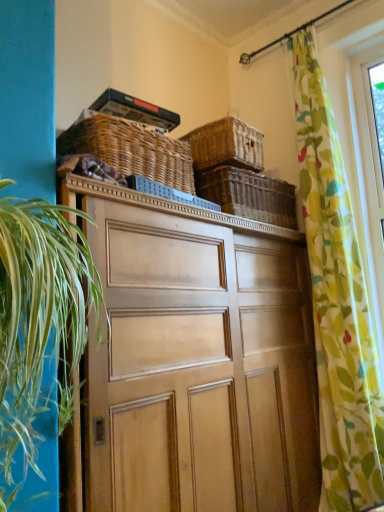
Question: From the image's perspective, would you say woven brown basket at upper center, marked as the third basket in a right-to-left arrangement, is shown under woven brown basket at upper center, which is the 2th basket in right-to-left order?

Choices:
 (A) no
 (B) yes

Answer: (B)

Question: Does woven brown basket at upper center, marked as the third basket in a right-to-left arrangement, have a greater width compared to woven brown basket at upper center, which is the 2th basket in right-to-left order?

Choices:
 (A) yes
 (B) no

Answer: (B)

Question: Is woven brown basket at upper center, which is the 2th basket in right-to-left order, at the back of woven brown basket at upper center, marked as the third basket in a right-to-left arrangement?

Choices:
 (A) no
 (B) yes

Answer: (A)

Question: Is woven brown basket at upper center, positioned as the first basket in left-to-right order, shorter than woven brown basket at upper center, which is counted as the 2th basket, starting from the left?

Choices:
 (A) yes
 (B) no

Answer: (B)

Question: Is woven brown basket at upper center, positioned as the first basket in left-to-right order, at the right side of woven brown basket at upper center, which is the 2th basket in right-to-left order?

Choices:
 (A) no
 (B) yes

Answer: (A)

Question: Considering the relative sizes of woven brown basket at upper center, positioned as the first basket in left-to-right order, and woven brown basket at upper center, which is counted as the 2th basket, starting from the left, in the image provided, is woven brown basket at upper center, positioned as the first basket in left-to-right order, taller than woven brown basket at upper center, which is counted as the 2th basket, starting from the left,?

Choices:
 (A) no
 (B) yes

Answer: (B)

Question: Considering the relative sizes of woven wicker basket at upper center, the 1th basket when ordered from right to left, and green leafy plant at left in the image provided, is woven wicker basket at upper center, the 1th basket when ordered from right to left, bigger than green leafy plant at left?

Choices:
 (A) yes
 (B) no

Answer: (B)

Question: Could you tell me if woven wicker basket at upper center, the 1th basket when ordered from right to left, is turned towards green leafy plant at left?

Choices:
 (A) yes
 (B) no

Answer: (B)

Question: Is woven wicker basket at upper center, the third basket when ordered from left to right, positioned far away from green leafy plant at left?

Choices:
 (A) no
 (B) yes

Answer: (B)

Question: Is woven wicker basket at upper center, the 1th basket when ordered from right to left, positioned beyond the bounds of green leafy plant at left?

Choices:
 (A) no
 (B) yes

Answer: (B)

Question: Is green leafy plant at left located within woven wicker basket at upper center, the third basket when ordered from left to right?

Choices:
 (A) no
 (B) yes

Answer: (A)

Question: From the image's perspective, is woven wicker basket at upper center, the third basket when ordered from left to right, below green leafy plant at left?

Choices:
 (A) no
 (B) yes

Answer: (A)

Question: Is there a large distance between wooden cabinet at center and woven brown basket at upper center, which is counted as the 2th basket, starting from the left?

Choices:
 (A) no
 (B) yes

Answer: (A)